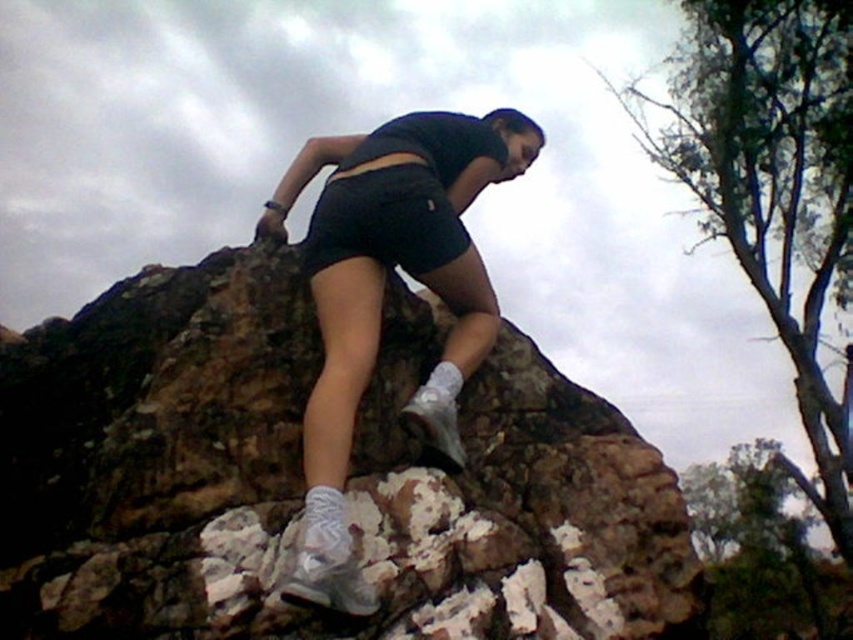
Between brown rough rock at center and white matte sneakers at center, which one is positioned lower?

brown rough rock at center

Between point (175, 508) and point (331, 365), which one is positioned in front?

Point (175, 508)

Describe the element at coordinates (300, 481) in the screenshot. I see `brown rough rock at center` at that location.

At what (x,y) coordinates should I click in order to perform the action: click on brown rough rock at center. Please return your answer as a coordinate pair (x, y). Image resolution: width=853 pixels, height=640 pixels. Looking at the image, I should click on (300, 481).

Does white matte sneakers at center lie behind black matte shorts at center?

No, white matte sneakers at center is closer to the viewer.

You are a GUI agent. You are given a task and a screenshot of the screen. Output one action in this format:
    pyautogui.click(x=<x>, y=<y>)
    Task: Click on the white matte sneakers at center
    The image size is (853, 640).
    Given the screenshot: What is the action you would take?
    pyautogui.click(x=381, y=294)

Which is behind, point (332, 307) or point (320, 243)?

The point (320, 243) is behind.

The height and width of the screenshot is (640, 853). Identify the location of white matte sneakers at center. (381, 294).

Who is more forward, (698, 588) or (436, 220)?

Point (698, 588) is more forward.

Does brown rough rock at center have a larger size compared to black matte shorts at center?

Indeed, brown rough rock at center has a larger size compared to black matte shorts at center.

Is point (258, 433) closer to viewer compared to point (419, 256)?

That is True.

Locate an element on the screen. This screenshot has width=853, height=640. brown rough rock at center is located at coordinates (300, 481).